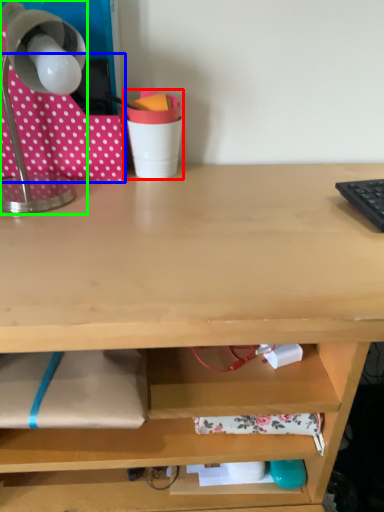
Question: Based on their relative distances, which object is farther from stationery (highlighted by a red box)? Choose from fabric (highlighted by a blue box) and lamp (highlighted by a green box).

Choices:
 (A) fabric
 (B) lamp

Answer: (B)